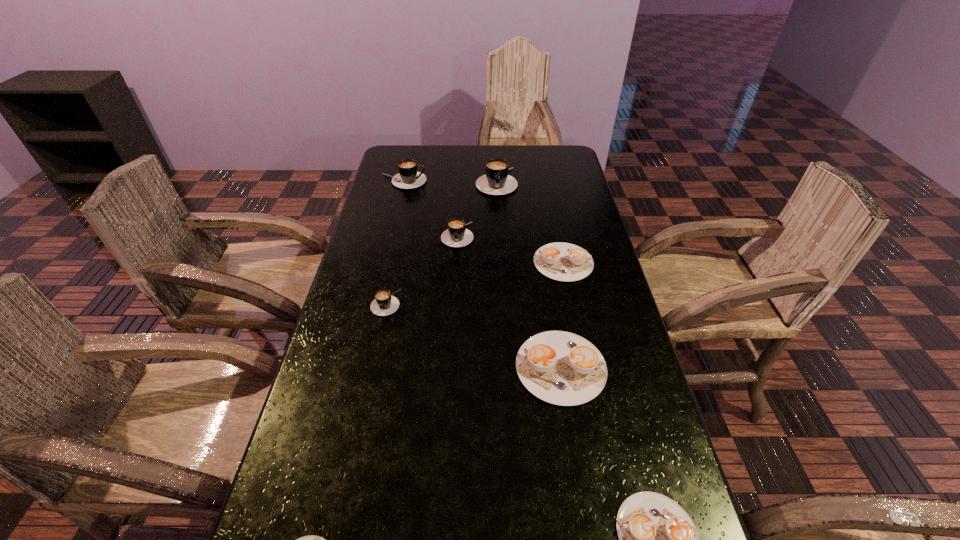
Identify the location of the third shortest cappuccino. Image resolution: width=960 pixels, height=540 pixels. (560, 261).

Find the location of a particular element. the third shortest object is located at coordinates (560, 261).

What are the coordinates of `free region located with the handle on the side of the biggest black cappuccino` in the screenshot? It's located at (497, 206).

At what (x,y) coordinates should I click in order to perform the action: click on vacant region located with the handle on the side of the third smallest black cappuccino. Please return your answer as a coordinate pair (x, y). This screenshot has height=540, width=960. Looking at the image, I should click on (494, 181).

Identify the location of free space located 0.110m with the handle on the side of the fourth object from left to right. This screenshot has width=960, height=540. (455, 272).

At what (x,y) coordinates should I click in order to perform the action: click on blank area located with the handle on the side of the nearest black cappuccino. Please return your answer as a coordinate pair (x, y). Looking at the image, I should click on (364, 404).

Locate an element on the screen. Image resolution: width=960 pixels, height=540 pixels. vacant space located 0.200m on the front of the third nearest object is located at coordinates (583, 502).

Where is `vacant area located 0.150m on the back of the farthest white cappuccino`? Image resolution: width=960 pixels, height=540 pixels. vacant area located 0.150m on the back of the farthest white cappuccino is located at coordinates [554, 217].

Identify the location of object present at the far left corner. Image resolution: width=960 pixels, height=540 pixels. (408, 177).

Identify the location of free spot at the far edge of the desktop. Image resolution: width=960 pixels, height=540 pixels. (463, 164).